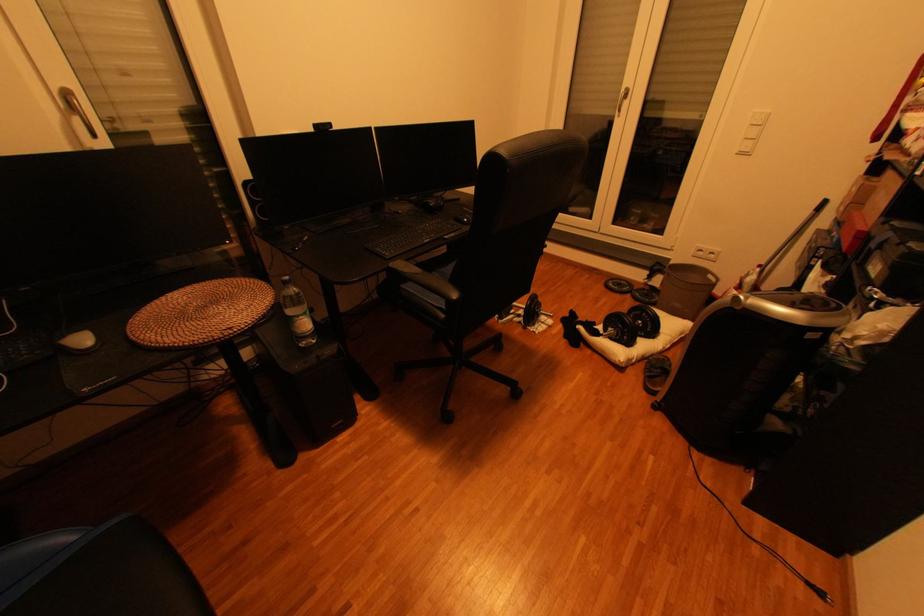
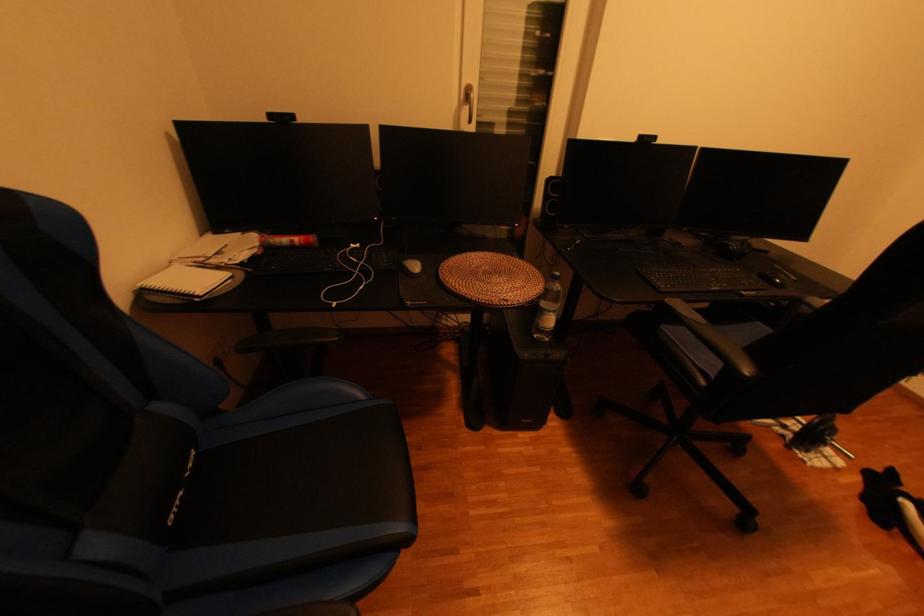
Question: Based on the continuous images, in which direction is the camera rotating? Reply with the corresponding letter.

Choices:
 (A) Left
 (B) Right
 (C) Up
 (D) Down

Answer: (A)